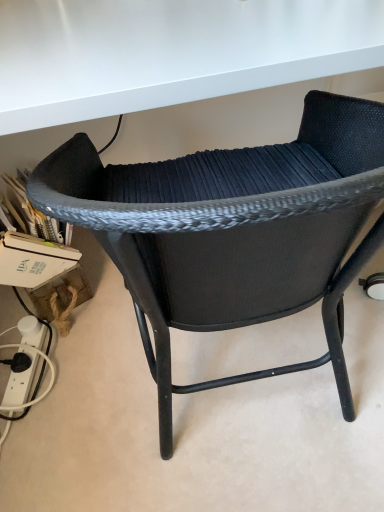
I want to click on free point behind black plastic plug at lower left, so pos(36,325).